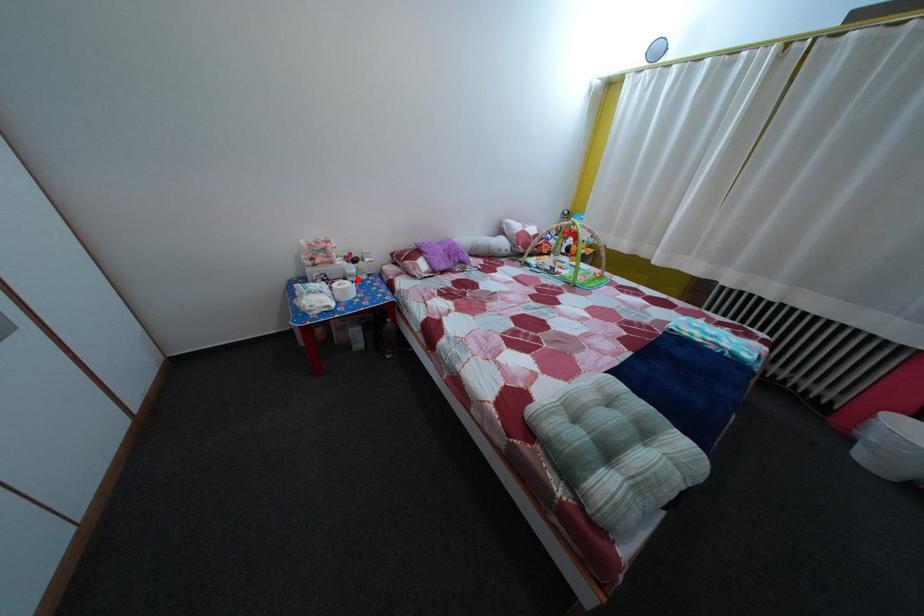
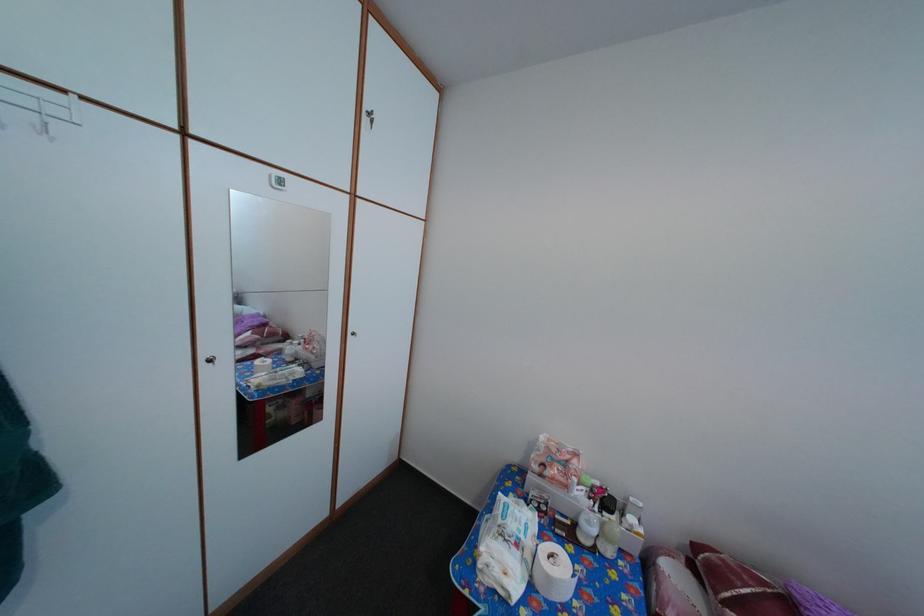
Question: I am providing you with two images of the same scene from different viewpoints. A red point is shown in image1. For the corresponding object point in image2, is it positioned nearer or farther from the camera?

Choices:
 (A) Nearer
 (B) Farther

Answer: (B)